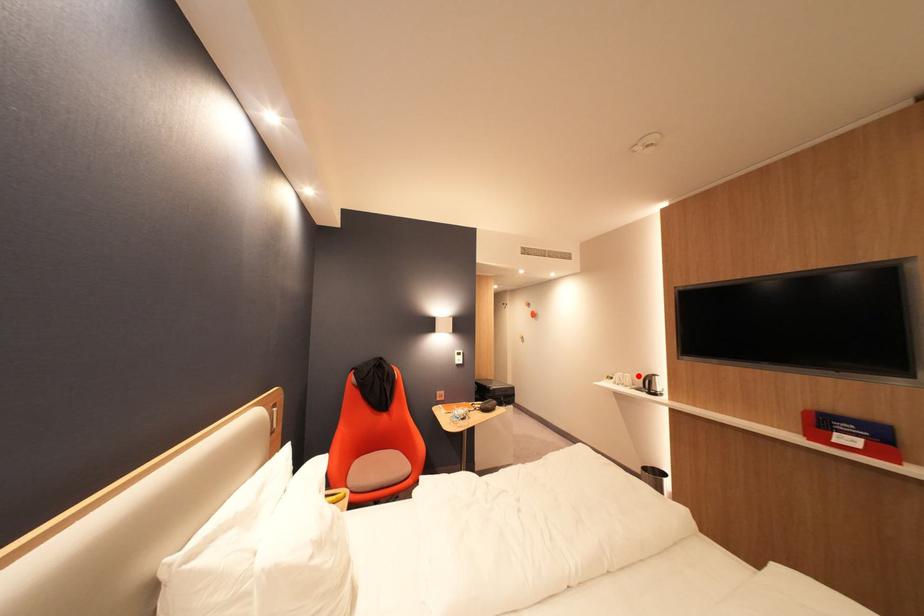
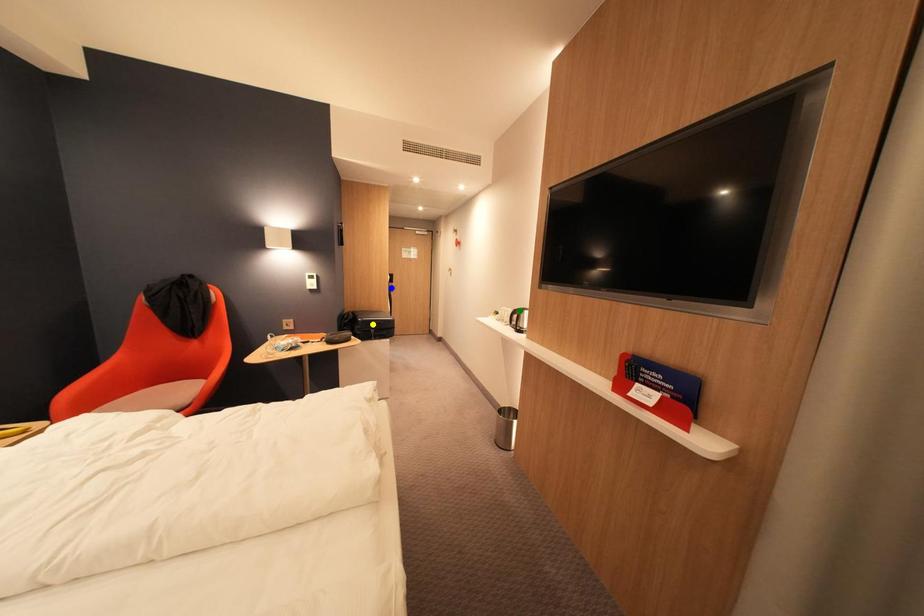
Question: I am providing you with two images of the same scene from different viewpoints. A red point is marked on the first image. You are given multiple points on the second image. In image 2, which mark is for the same physical point as the one in image 1?

Choices:
 (A) green point
 (B) blue point
 (C) yellow point

Answer: (A)